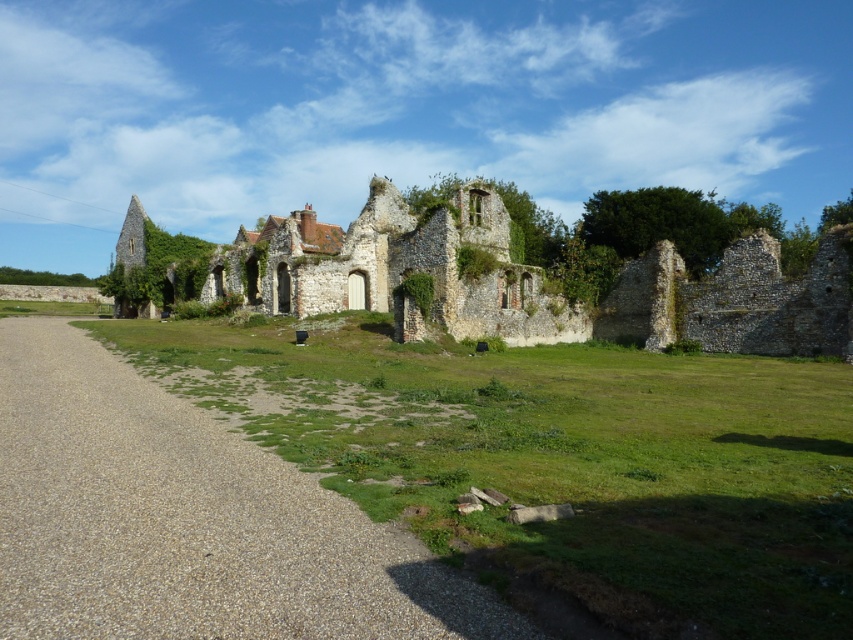
Question: Which point is farther from the camera taking this photo?

Choices:
 (A) (525, 337)
 (B) (45, 456)

Answer: (A)

Question: Does gravelly path at center have a smaller size compared to stone ruins at center?

Choices:
 (A) no
 (B) yes

Answer: (B)

Question: Does gravelly path at center appear on the left side of stone ruins at center?

Choices:
 (A) yes
 (B) no

Answer: (A)

Question: Where is gravelly path at center located in relation to stone ruins at center in the image?

Choices:
 (A) right
 (B) left

Answer: (B)